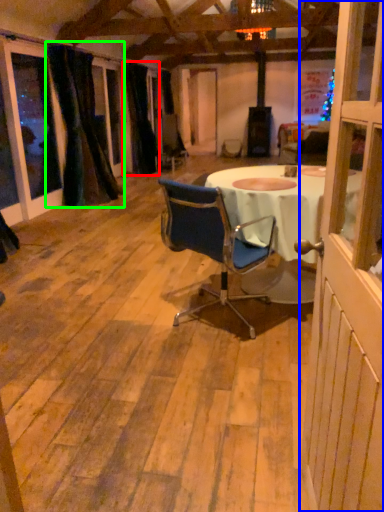
Question: Considering the real-world distances, which object is closest to curtain (highlighted by a red box)? screen door (highlighted by a blue box) or curtain (highlighted by a green box).

Choices:
 (A) screen door
 (B) curtain

Answer: (B)